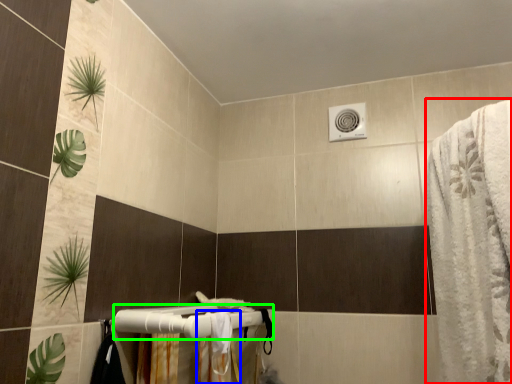
Question: Considering the real-world distances, which object is closest to bath towel (highlighted by a red box)? shower curtain (highlighted by a blue box) or towel bar (highlighted by a green box).

Choices:
 (A) shower curtain
 (B) towel bar

Answer: (A)